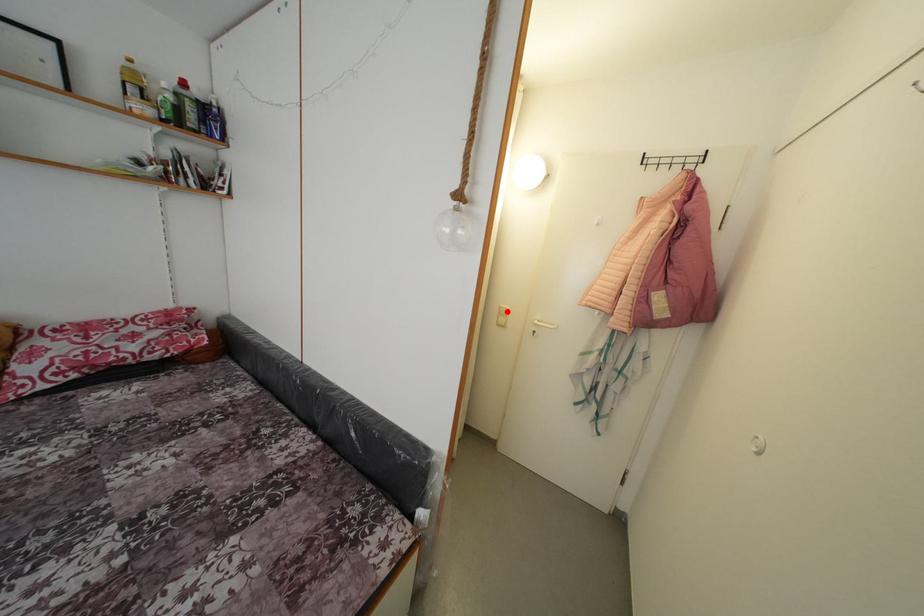
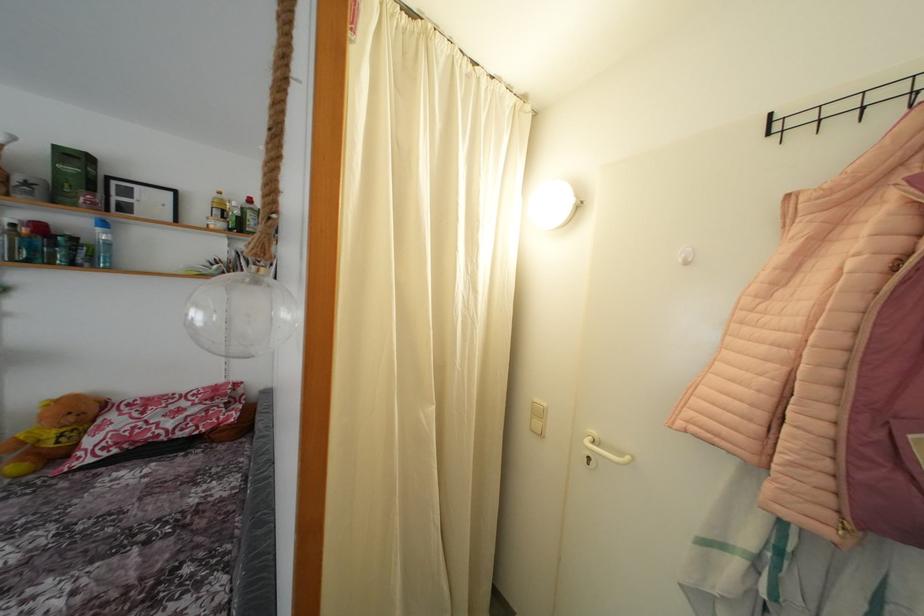
Where in the second image is the point corresponding to the highlighted location from the first image?

(541, 406)